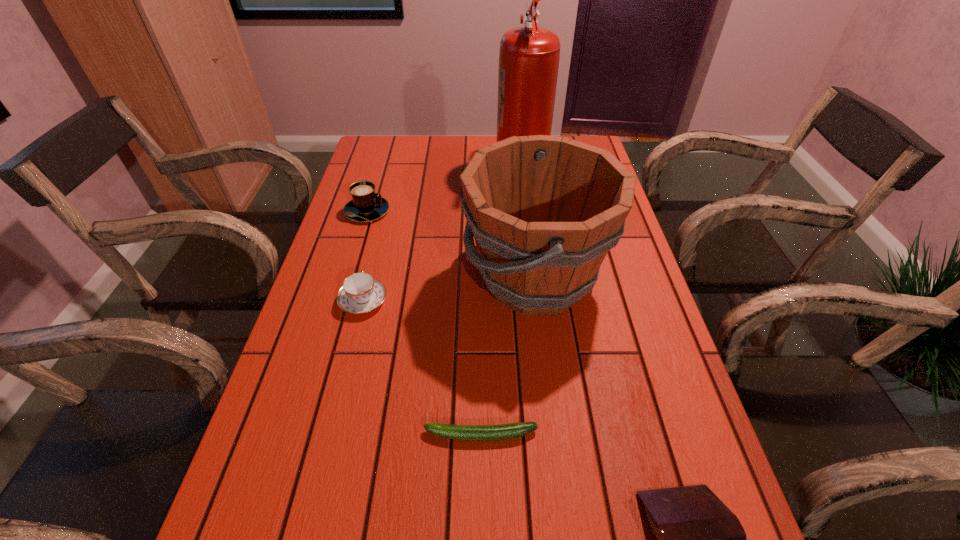
Where is `vacant space situated on the instruction side of the fire extinguisher`? vacant space situated on the instruction side of the fire extinguisher is located at coordinates (439, 166).

Identify the location of free location located 0.260m on the handle side of the fifth shortest object. The height and width of the screenshot is (540, 960). (359, 278).

You are a GUI agent. You are given a task and a screenshot of the screen. Output one action in this format:
    pyautogui.click(x=<x>, y=<y>)
    Task: Click on the vacant area located 0.350m on the handle side of the fifth shortest object
    This screenshot has height=540, width=960.
    Given the screenshot: What is the action you would take?
    pyautogui.click(x=323, y=278)

At what (x,y) coordinates should I click in order to perform the action: click on vacant region located 0.220m on the handle side of the fifth shortest object. Please return your answer as a coordinate pair (x, y). The height and width of the screenshot is (540, 960). Looking at the image, I should click on (375, 278).

You are a GUI agent. You are given a task and a screenshot of the screen. Output one action in this format:
    pyautogui.click(x=<x>, y=<y>)
    Task: Click on the free location located 0.390m on the front of the second farthest object
    The width and height of the screenshot is (960, 540).
    Given the screenshot: What is the action you would take?
    pyautogui.click(x=329, y=336)

I want to click on free region located on the side with the handle of the teacup, so 384,217.

This screenshot has width=960, height=540. Find the location of `free space located on the side with the handle of the teacup`. free space located on the side with the handle of the teacup is located at coordinates (387, 204).

You are a GUI agent. You are given a task and a screenshot of the screen. Output one action in this format:
    pyautogui.click(x=<x>, y=<y>)
    Task: Click on the free point located 0.320m on the side with the handle of the teacup
    This screenshot has height=540, width=960.
    Given the screenshot: What is the action you would take?
    pyautogui.click(x=387, y=206)

Where is `free space located 0.080m on the front-facing side of the second nearest object`? The width and height of the screenshot is (960, 540). free space located 0.080m on the front-facing side of the second nearest object is located at coordinates (381, 435).

Where is `vacant space located on the front-facing side of the second nearest object`? The image size is (960, 540). vacant space located on the front-facing side of the second nearest object is located at coordinates (267, 435).